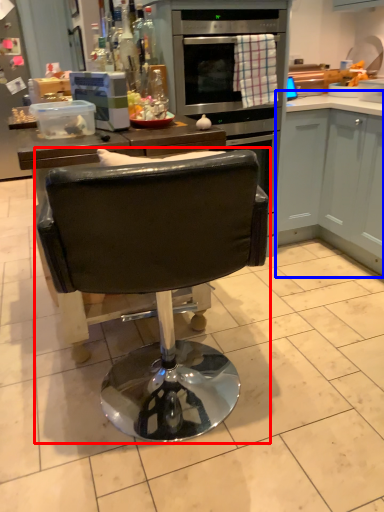
Question: Which of the following is the farthest to the observer, chair (highlighted by a red box) or cabinetry (highlighted by a blue box)?

Choices:
 (A) chair
 (B) cabinetry

Answer: (B)